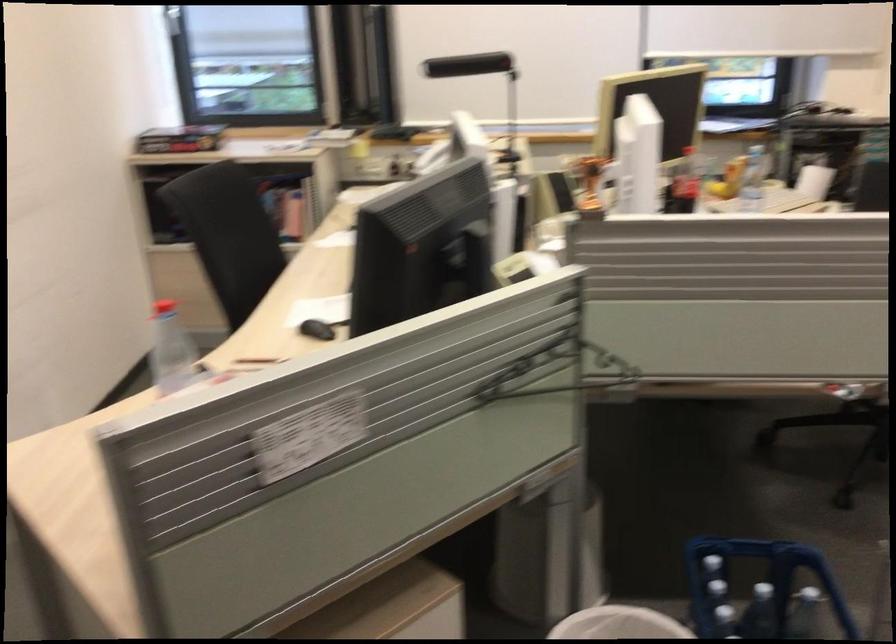
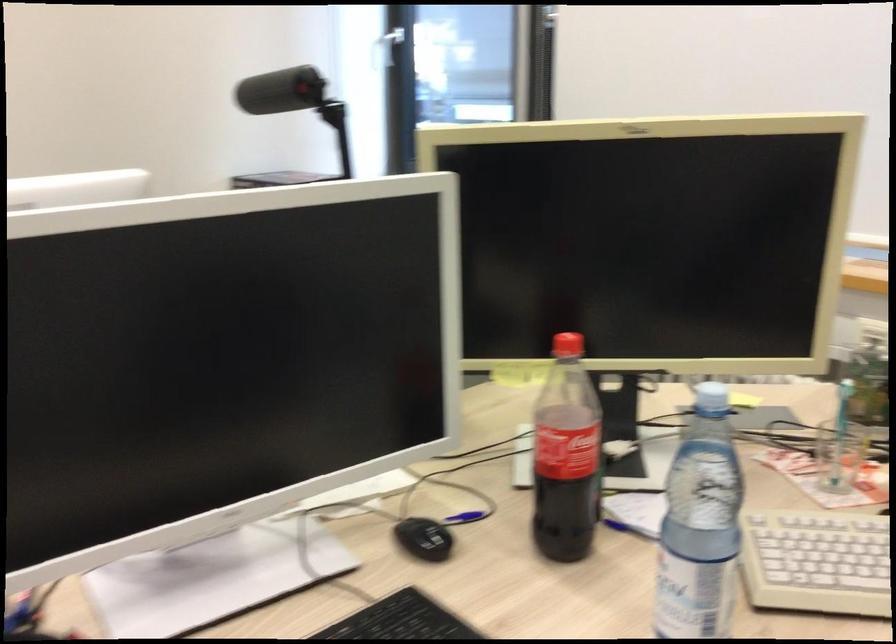
Where in the second image is the point corresponding to point 736,204 from the first image?

(815, 562)